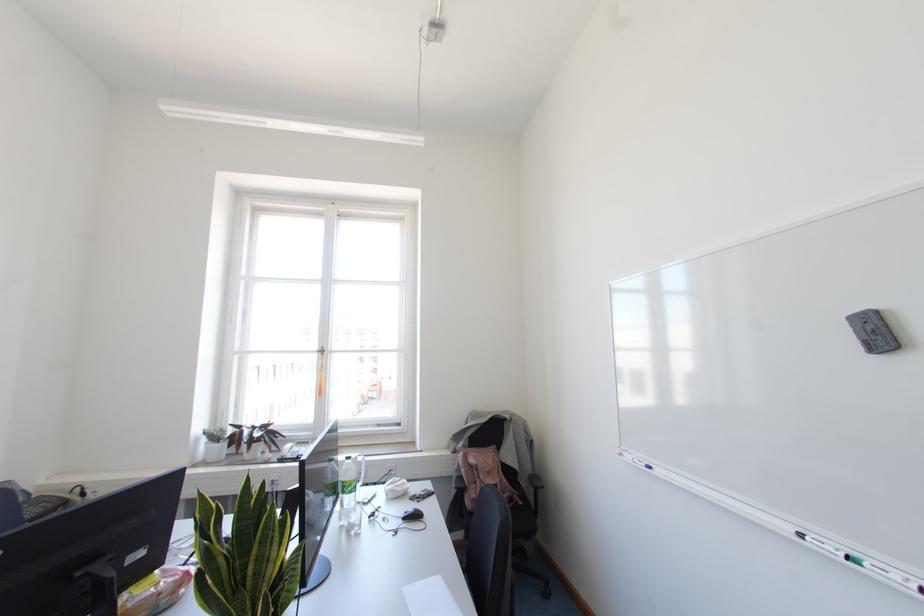
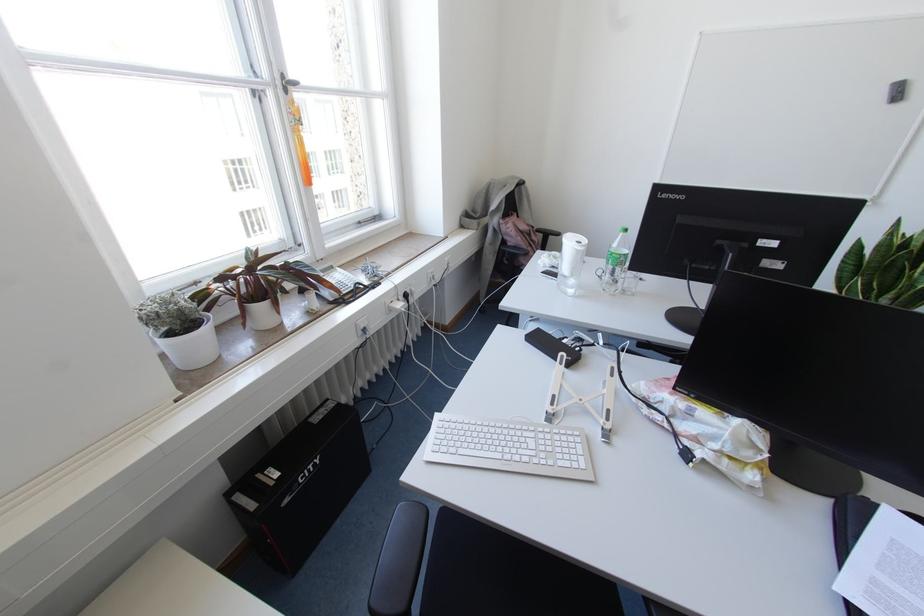
Where in the second image is the point corresponding to [310,444] from the first image?

(336, 268)